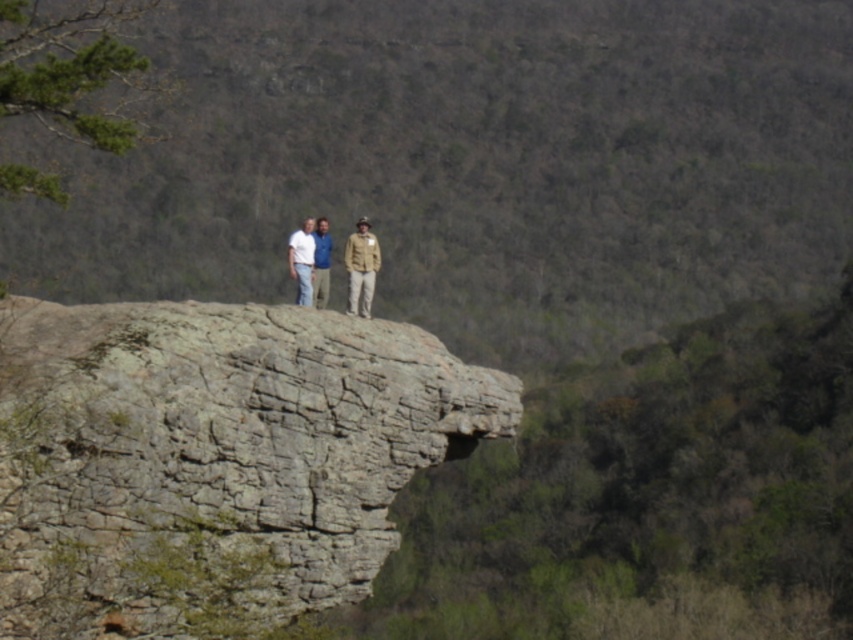
Question: Among these points, which one is farthest from the camera?

Choices:
 (A) (352, 262)
 (B) (358, 264)
 (C) (635, 173)
 (D) (320, 531)

Answer: (C)

Question: Which object appears farthest from the camera in this image?

Choices:
 (A) brown leather jacket at center
 (B) khaki fabric jacket at center
 (C) white cotton shirt at center

Answer: (C)

Question: Estimate the real-world distances between objects in this image. Which object is closer to the gray rough rock at center?

Choices:
 (A) gray rock formation at center
 (B) white cotton shirt at center
 (C) khaki fabric jacket at center

Answer: (C)

Question: Does gray rock formation at center appear on the left side of khaki fabric jacket at center?

Choices:
 (A) yes
 (B) no

Answer: (B)

Question: Does khaki cotton pants at center lie in front of khaki fabric jacket at center?

Choices:
 (A) no
 (B) yes

Answer: (B)

Question: Can you confirm if khaki fabric jacket at center is bigger than brown leather jacket at center?

Choices:
 (A) no
 (B) yes

Answer: (B)